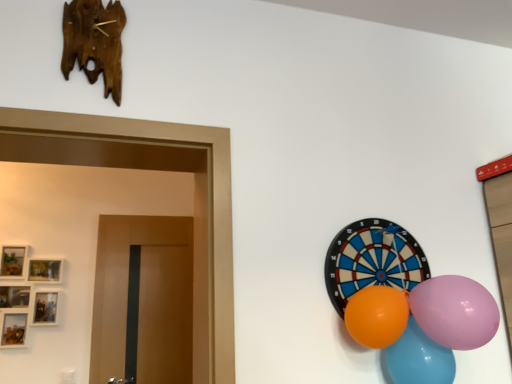
Question: From the image's perspective, would you say rubber balloon at right is shown under shiny plastic balloons at lower right, acting as the first balloon starting from the right?

Choices:
 (A) no
 (B) yes

Answer: (A)

Question: From the image's perspective, is rubber balloon at right over shiny plastic balloons at lower right, the third balloon from the left?

Choices:
 (A) yes
 (B) no

Answer: (A)

Question: Considering the relative sizes of rubber balloon at right and shiny plastic balloons at lower right, acting as the first balloon starting from the right, in the image provided, is rubber balloon at right smaller than shiny plastic balloons at lower right, acting as the first balloon starting from the right,?

Choices:
 (A) no
 (B) yes

Answer: (B)

Question: Is the position of rubber balloon at right more distant than that of shiny plastic balloons at lower right, acting as the first balloon starting from the right?

Choices:
 (A) yes
 (B) no

Answer: (A)

Question: Would you say rubber balloon at right is outside shiny plastic balloons at lower right, the third balloon from the left?

Choices:
 (A) no
 (B) yes

Answer: (B)

Question: Is rubber balloon at right facing towards shiny plastic balloons at lower right, the third balloon from the left?

Choices:
 (A) no
 (B) yes

Answer: (A)

Question: From the image's perspective, does orange rubber balloon at right, the first balloon positioned from the left, appear lower than shiny plastic balloons at lower right, acting as the first balloon starting from the right?

Choices:
 (A) yes
 (B) no

Answer: (B)

Question: Is orange rubber balloon at right, the first balloon positioned from the left, further to camera compared to shiny plastic balloons at lower right, the third balloon from the left?

Choices:
 (A) yes
 (B) no

Answer: (B)

Question: Does orange rubber balloon at right, the first balloon positioned from the left, have a larger size compared to shiny plastic balloons at lower right, acting as the first balloon starting from the right?

Choices:
 (A) yes
 (B) no

Answer: (B)

Question: Is orange rubber balloon at right, the third balloon positioned from the right, wider than shiny plastic balloons at lower right, the third balloon from the left?

Choices:
 (A) no
 (B) yes

Answer: (B)

Question: Is orange rubber balloon at right, the third balloon positioned from the right, closer to camera compared to shiny plastic balloons at lower right, the third balloon from the left?

Choices:
 (A) yes
 (B) no

Answer: (A)

Question: Is orange rubber balloon at right, the first balloon positioned from the left, not close to shiny plastic balloons at lower right, the third balloon from the left?

Choices:
 (A) yes
 (B) no

Answer: (B)

Question: Can you confirm if pink glossy balloon at right, which appears as the second balloon when viewed from the right, is taller than rubber balloon at right?

Choices:
 (A) yes
 (B) no

Answer: (B)